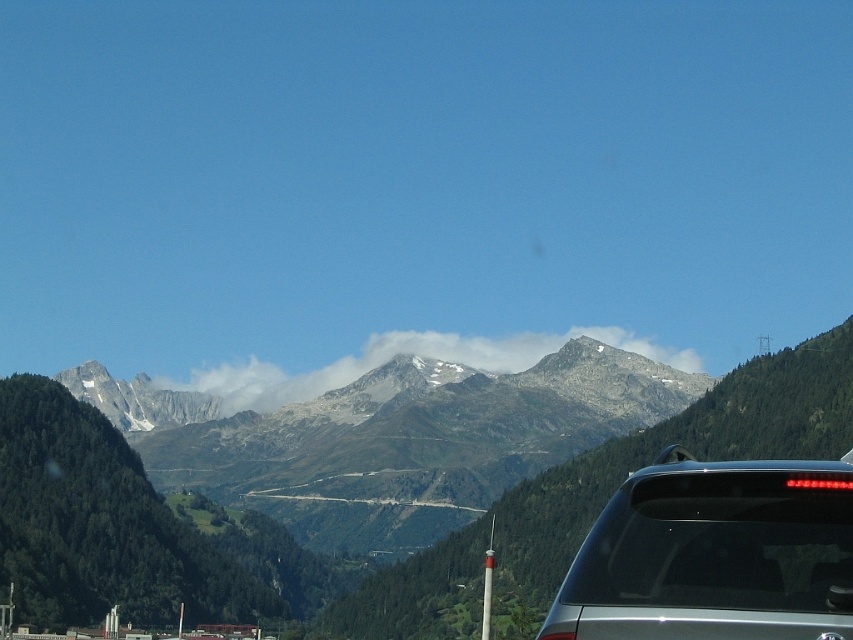
Can you confirm if silver metallic car at lower right is shorter than white fluffy cloud at center?

No.

Can you confirm if silver metallic car at lower right is smaller than white fluffy cloud at center?

Incorrect, silver metallic car at lower right is not smaller in size than white fluffy cloud at center.

Is point (840, 493) positioned behind point (390, 349)?

No, it is in front of (390, 349).

I want to click on silver metallic car at lower right, so 714,554.

Does gray rocky mountain range at center have a greater width compared to white fluffy cloud at center?

Correct, the width of gray rocky mountain range at center exceeds that of white fluffy cloud at center.

Who is more distant from viewer, (312,584) or (200,387)?

The point (200,387) is more distant.

The height and width of the screenshot is (640, 853). I want to click on gray rocky mountain range at center, so pyautogui.click(x=186, y=544).

Based on the photo, does gray rocky mountain range at center appear on the left side of silver metallic car at lower right?

Indeed, gray rocky mountain range at center is positioned on the left side of silver metallic car at lower right.

Between gray rocky mountain range at center and silver metallic car at lower right, which one has less height?

Standing shorter between the two is silver metallic car at lower right.

Identify the location of gray rocky mountain range at center. (186, 544).